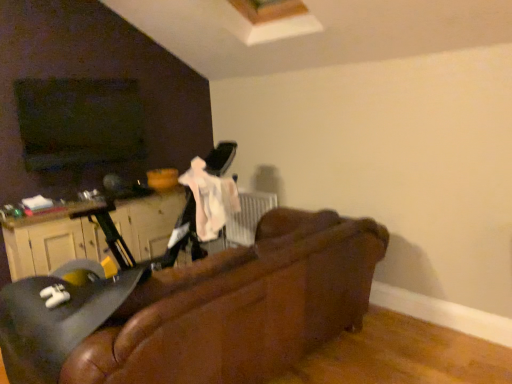
The height and width of the screenshot is (384, 512). What do you see at coordinates (240, 307) in the screenshot? I see `leather couch at center` at bounding box center [240, 307].

What is the approximate height of leather couch at center?

35.08 inches.

Find the location of `matte black swivel chair at left`. matte black swivel chair at left is located at coordinates (55, 320).

From the picture: Considering the relative sizes of matte black swivel chair at left and wooden dresser at left in the image provided, is matte black swivel chair at left taller than wooden dresser at left?

Yes.

Is matte black swivel chair at left aimed at wooden dresser at left?

No, matte black swivel chair at left is not turned towards wooden dresser at left.

Locate an element on the screen. This screenshot has height=384, width=512. dresser positioned vertically above the matte black swivel chair at left (from a real-world perspective) is located at coordinates (51, 244).

Considering the relative sizes of matte black swivel chair at left and leather couch at center in the image provided, is matte black swivel chair at left smaller than leather couch at center?

Yes, matte black swivel chair at left is smaller than leather couch at center.

How different are the orientations of matte black swivel chair at left and leather couch at center in degrees?

0.000151 degrees separate the facing orientations of matte black swivel chair at left and leather couch at center.

From a real-world perspective, between matte black swivel chair at left and leather couch at center, who is vertically lower?

In real-world perspective, leather couch at center is lower.

Which object is thinner, matte black swivel chair at left or leather couch at center?

With smaller width is matte black swivel chair at left.

From a real-world perspective, which is physically above, wooden dresser at left or matte black swivel chair at left?

wooden dresser at left is physically above.

From the image's perspective, relative to matte black swivel chair at left, is wooden dresser at left above or below?

wooden dresser at left is situated higher than matte black swivel chair at left in the image.

From the picture: Considering the sizes of wooden dresser at left and matte black swivel chair at left in the image, is wooden dresser at left bigger or smaller than matte black swivel chair at left?

Clearly, wooden dresser at left is smaller in size than matte black swivel chair at left.

Is leather couch at center in contact with matte black swivel chair at left?

No, leather couch at center is not beside matte black swivel chair at left.

From a real-world perspective, is leather couch at center positioned above or below matte black swivel chair at left?

Clearly, from a real-world perspective, leather couch at center is below matte black swivel chair at left.

Between leather couch at center and matte black swivel chair at left, which one has smaller size?

matte black swivel chair at left is smaller.

Is leather couch at center located outside matte black swivel chair at left?

That's correct, leather couch at center is outside of matte black swivel chair at left.

Is wooden dresser at left far away from leather couch at center?

Yes, wooden dresser at left is far from leather couch at center.

Considering the sizes of wooden dresser at left and leather couch at center in the image, is wooden dresser at left bigger or smaller than leather couch at center?

In the image, wooden dresser at left appears to be smaller than leather couch at center.

Is the position of wooden dresser at left more distant than that of leather couch at center?

Yes, wooden dresser at left is further from the viewer.

Can you confirm if leather couch at center is wider than wooden dresser at left?

Correct, the width of leather couch at center exceeds that of wooden dresser at left.

Consider the image. Is leather couch at center next to wooden dresser at left?

They are not placed beside each other.

Does leather couch at center have a greater height compared to wooden dresser at left?

Indeed, leather couch at center has a greater height compared to wooden dresser at left.

Considering the relative positions of leather couch at center and wooden dresser at left in the image provided, is leather couch at center in front of wooden dresser at left?

Yes, it is in front of wooden dresser at left.

This screenshot has width=512, height=384. What are the coordinates of `dresser lying on the left of matte black swivel chair at left` in the screenshot? It's located at (51, 244).

Identify the location of studio couch lying in front of the matte black swivel chair at left. The height and width of the screenshot is (384, 512). (240, 307).

Based on the photo, when comparing their distances from wooden dresser at left, does leather couch at center or matte black swivel chair at left seem closer?

Based on the image, matte black swivel chair at left appears to be nearer to wooden dresser at left.

When comparing their distances from wooden dresser at left, does matte black swivel chair at left or leather couch at center seem further?

leather couch at center lies further to wooden dresser at left than the other object.

Considering their positions, is wooden dresser at left positioned closer to leather couch at center than matte black swivel chair at left?

matte black swivel chair at left lies closer to leather couch at center than the other object.

From the image, which object appears to be farther from leather couch at center, matte black swivel chair at left or wooden dresser at left?

wooden dresser at left is further to leather couch at center.

Which object lies further to the anchor point matte black swivel chair at left, wooden dresser at left or leather couch at center?

Among the two, wooden dresser at left is located further to matte black swivel chair at left.

Which object lies nearer to the anchor point matte black swivel chair at left, leather couch at center or wooden dresser at left?

leather couch at center is positioned closer to the anchor matte black swivel chair at left.

I want to click on swivel chair positioned between leather couch at center and wooden dresser at left from near to far, so click(x=55, y=320).